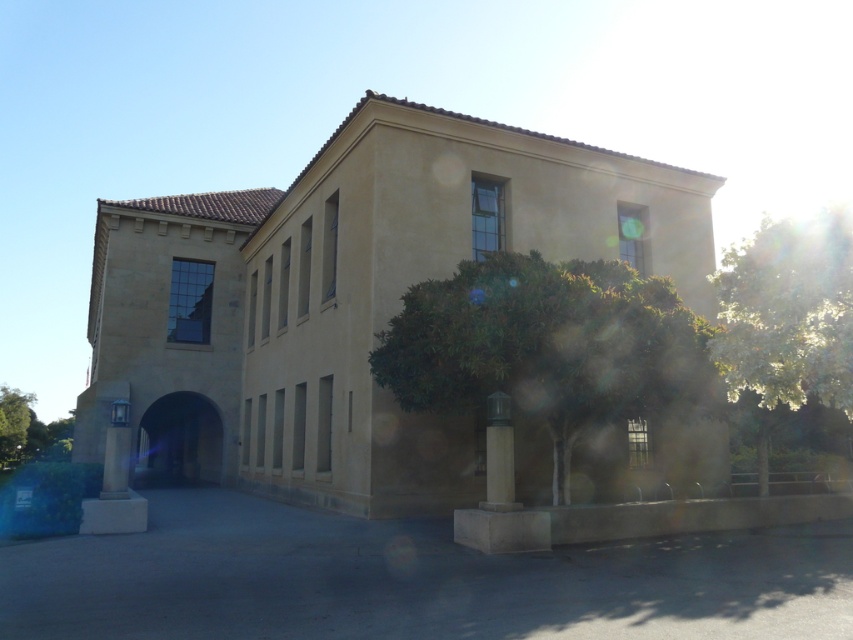
Does green leafy tree at center come in front of green leafy tree at left?

Yes, it is.

Does point (546, 406) lie in front of point (16, 413)?

Yes, point (546, 406) is in front of point (16, 413).

You are a GUI agent. You are given a task and a screenshot of the screen. Output one action in this format:
    pyautogui.click(x=<x>, y=<y>)
    Task: Click on the green leafy tree at center
    This screenshot has height=640, width=853.
    Given the screenshot: What is the action you would take?
    pyautogui.click(x=548, y=348)

The width and height of the screenshot is (853, 640). Describe the element at coordinates (548, 348) in the screenshot. I see `green leafy tree at center` at that location.

Is point (518, 336) in front of point (766, 353)?

No, (518, 336) is behind (766, 353).

The height and width of the screenshot is (640, 853). I want to click on green leafy tree at center, so click(x=548, y=348).

Locate an element on the screen. The image size is (853, 640). green leafy tree at center is located at coordinates (548, 348).

How much distance is there between green leafy tree at right and green leafy tree at left?

The distance of green leafy tree at right from green leafy tree at left is 59.33 meters.

Measure the distance between green leafy tree at right and camera.

The distance of green leafy tree at right from camera is 10.21 meters.

Locate an element on the screen. Image resolution: width=853 pixels, height=640 pixels. green leafy tree at right is located at coordinates (787, 317).